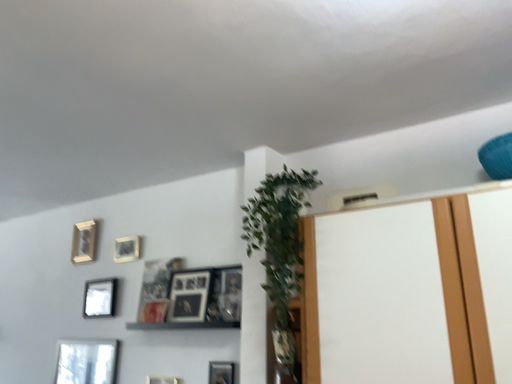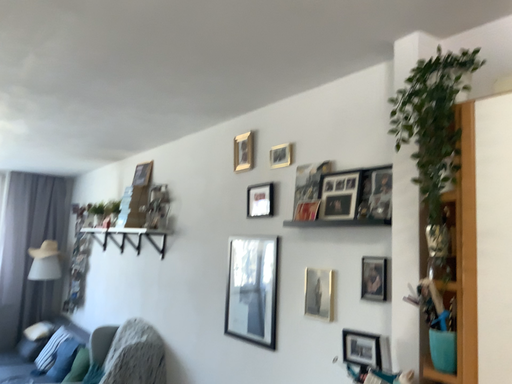
Question: Which way did the camera rotate in the video?

Choices:
 (A) rotated right
 (B) rotated left

Answer: (B)